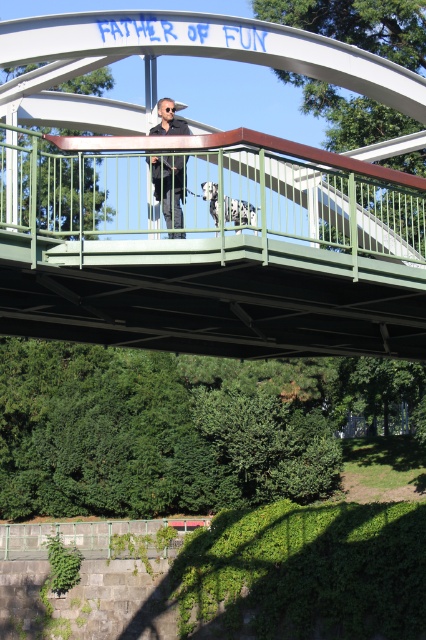
You are a photographer trying to capture the man and his dog on the bridge. You need to position your camera so that the matte black shirt at center and the white spotted fur at center are both in frame. Which object should be placed on the left side of the frame to ensure both are visible?

The matte black shirt at center should be placed on the left side of the frame because it is already to the left of the white spotted fur at center, ensuring both are visible when positioned this way.

You are a photographer trying to capture the white metal bridge at center and the white spotted fur at center in the same frame. Based on their positions, which object should you adjust your camera to focus on first to ensure both are in the shot?

Since the white metal bridge at center is to the left of white spotted fur at center, you should focus on the white metal bridge at center first to ensure both are included in the frame.